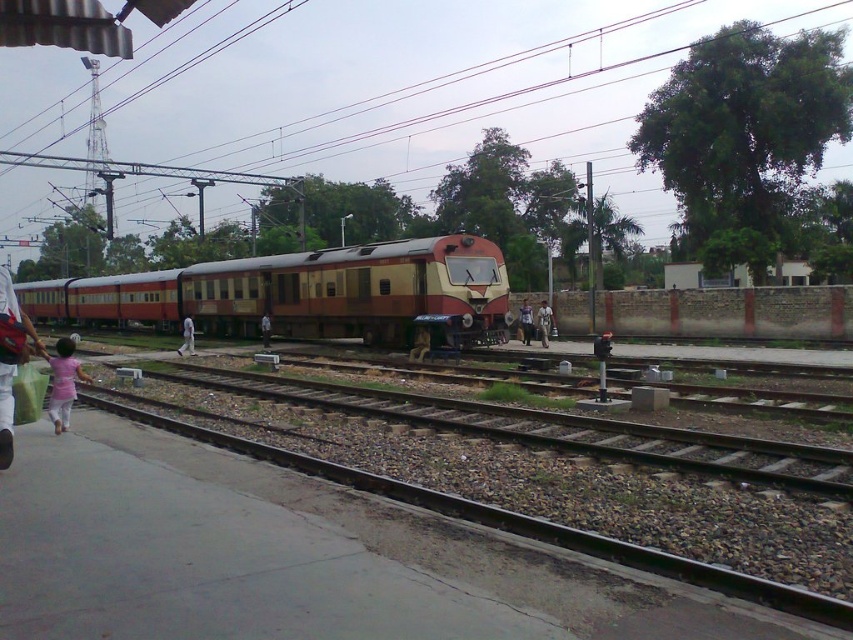
Identify the location of metallic wires at upper center. Image resolution: width=853 pixels, height=640 pixels. (437, 88).

How distant is metallic wires at upper center from light brown fabric shirt at center?

120.52 meters

Where is `metallic wires at upper center`? The image size is (853, 640). metallic wires at upper center is located at coordinates (437, 88).

Is smooth brown jacket at center shorter than white fabric person at center?

Indeed, smooth brown jacket at center has a lesser height compared to white fabric person at center.

Based on the photo, can you confirm if smooth brown jacket at center is wider than white fabric person at center?

Incorrect, smooth brown jacket at center's width does not surpass white fabric person at center's.

The width and height of the screenshot is (853, 640). What are the coordinates of `smooth brown jacket at center` in the screenshot? It's located at (419, 342).

Who is lower down, metallic wires at upper center or smooth brown jacket at center?

smooth brown jacket at center is below.

Is metallic wires at upper center positioned behind smooth brown jacket at center?

That is True.

Locate an element on the screen. The height and width of the screenshot is (640, 853). metallic wires at upper center is located at coordinates (437, 88).